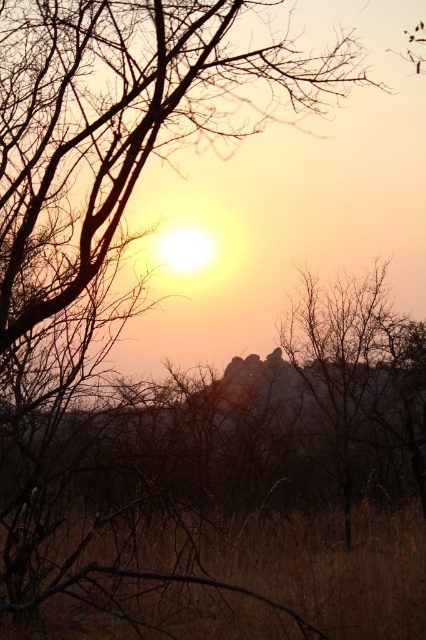
You are standing in the savanna looking at the sunset scene. There are two points in the image labeled as point 1 and point 2. Point 1 is at coordinates point (409, 609) and point 2 is at coordinates point (337, 404). Which point is closer to you?

Point (409, 609) is closer to the viewer than point (337, 404).

Consider the image. You are a hiker who has lost their way in the savanna. You see brown dry grass at lower center and a brown textured tree at center. Which object is taller?

The brown dry grass at lower center is taller than the brown textured tree at center.